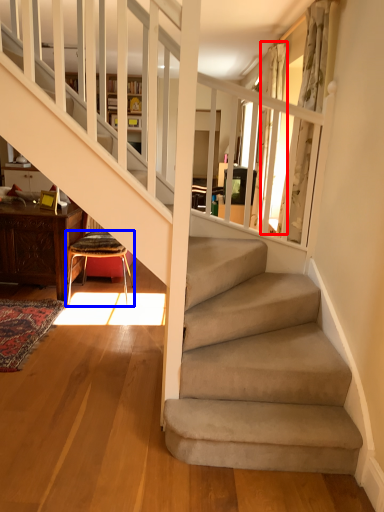
Question: Among these objects, which one is nearest to the camera, curtain (highlighted by a red box) or chair (highlighted by a blue box)?

Choices:
 (A) curtain
 (B) chair

Answer: (B)